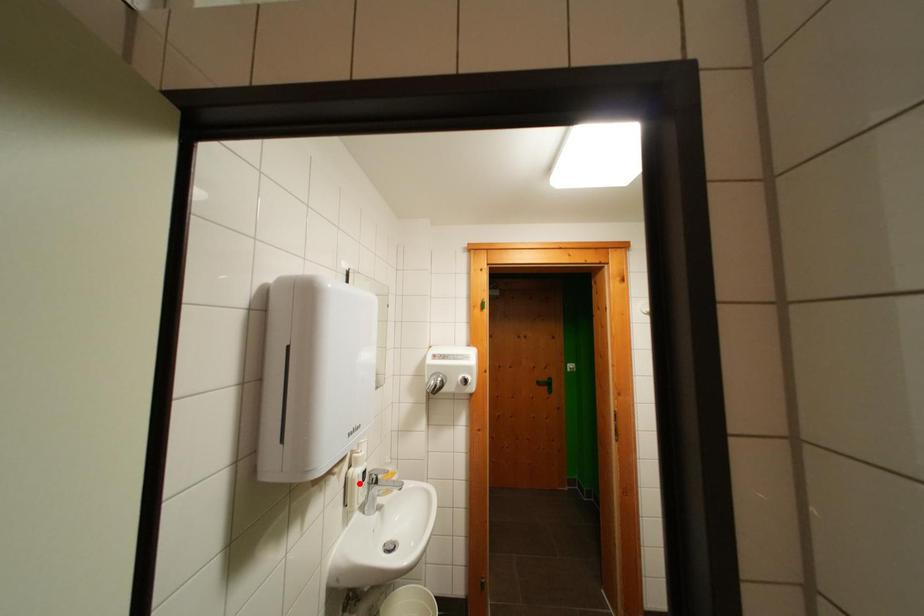
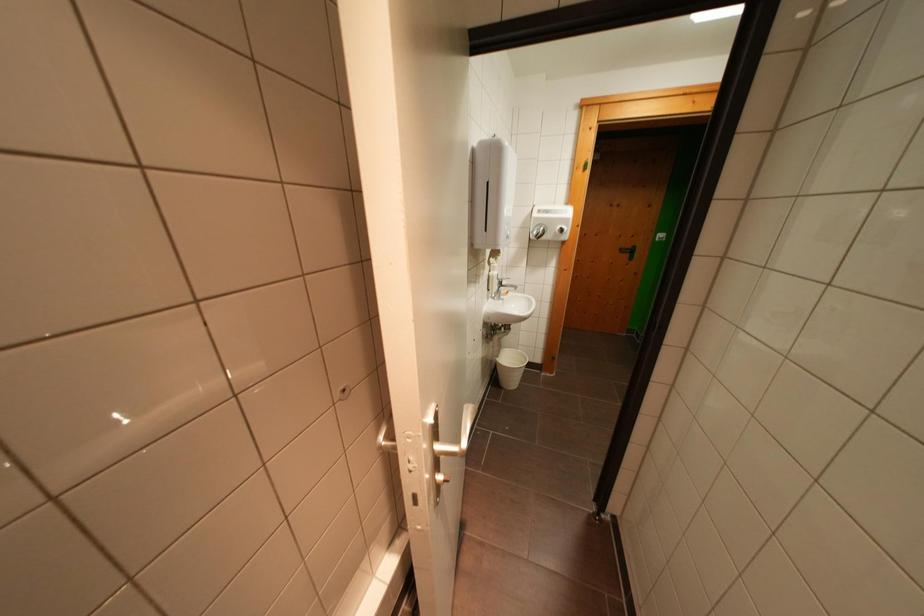
In the second image, find the point that corresponds to the highlighted location in the first image.

(500, 281)